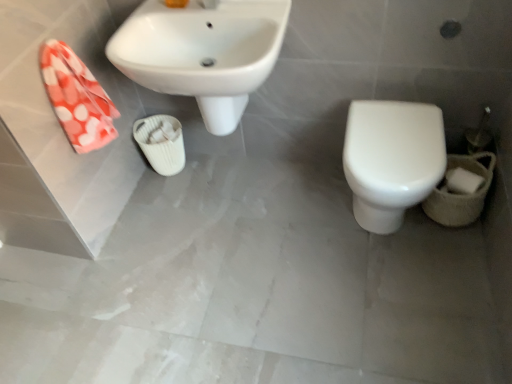
You are a GUI agent. You are given a task and a screenshot of the screen. Output one action in this format:
    pyautogui.click(x=<x>, y=<y>)
    Task: Click on the vacant area that is in front of white glossy toilet at lower right
    This screenshot has width=512, height=384.
    Given the screenshot: What is the action you would take?
    pyautogui.click(x=405, y=291)